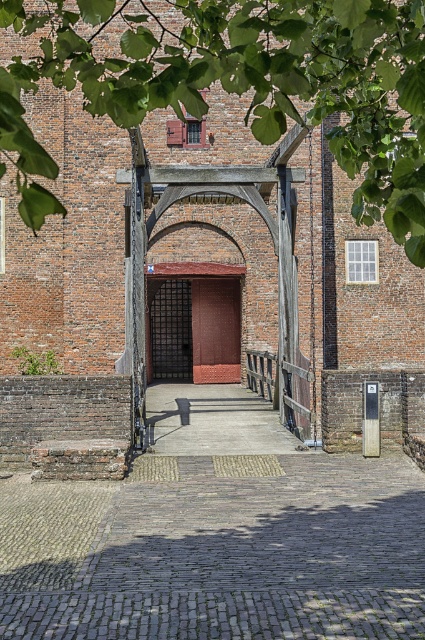
Question: Can you confirm if green leafy tree at upper center is positioned to the left of rustic wooden door at center?

Choices:
 (A) no
 (B) yes

Answer: (A)

Question: Considering the real-world distances, which object is closest to the green leafy tree at upper center?

Choices:
 (A) brick stair at lower left
 (B) brown wooden door at center
 (C) black metal gate at center

Answer: (A)

Question: Which point is closer to the camera?

Choices:
 (A) (45, 380)
 (B) (186, 369)

Answer: (A)

Question: Among these points, which one is nearest to the camera?

Choices:
 (A) (334, 77)
 (B) (159, 368)
 (C) (209, 346)
 (D) (116, 404)

Answer: (A)

Question: Can you confirm if green leafy tree at upper center is smaller than rustic wooden door at center?

Choices:
 (A) no
 (B) yes

Answer: (A)

Question: Can you confirm if brick stair at lower left is thinner than brown wooden door at center?

Choices:
 (A) no
 (B) yes

Answer: (A)